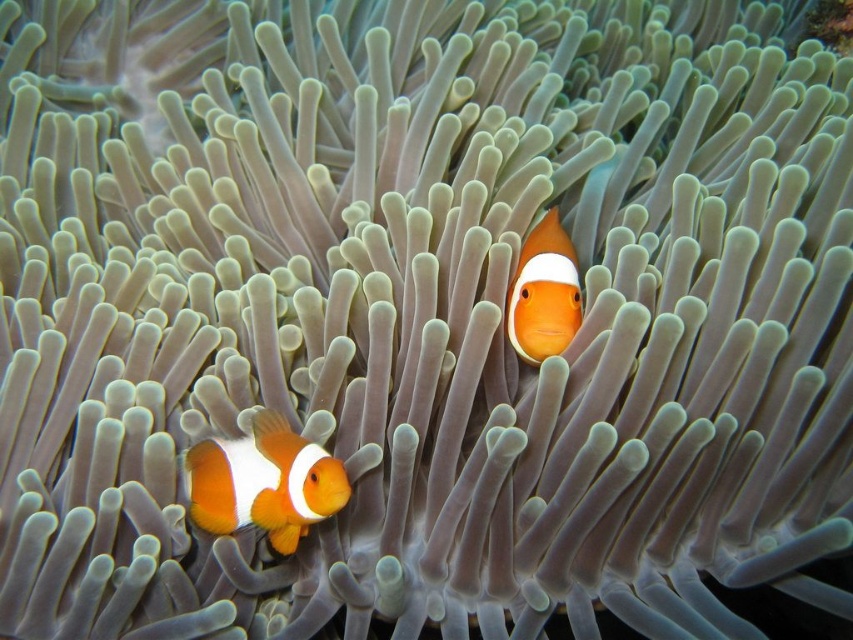
Question: Can you confirm if orange matte clownfish at lower left is bigger than orange matte clownfish at center?

Choices:
 (A) yes
 (B) no

Answer: (A)

Question: Which object is farther from the camera taking this photo?

Choices:
 (A) orange matte clownfish at center
 (B) orange matte clownfish at lower left

Answer: (A)

Question: Is orange matte clownfish at lower left bigger than orange matte clownfish at center?

Choices:
 (A) no
 (B) yes

Answer: (B)

Question: Is orange matte clownfish at lower left to the right of orange matte clownfish at center from the viewer's perspective?

Choices:
 (A) no
 (B) yes

Answer: (A)